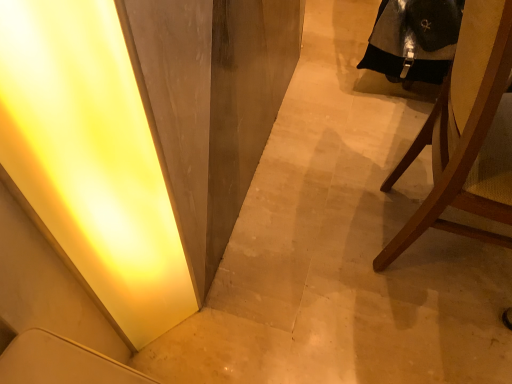
Question: Considering the positions of brown wooden chair at right and matte yellow light at lower left in the image, is brown wooden chair at right taller or shorter than matte yellow light at lower left?

Choices:
 (A) tall
 (B) short

Answer: (B)

Question: Would you say brown wooden chair at right is to the left or to the right of matte yellow light at lower left in the picture?

Choices:
 (A) left
 (B) right

Answer: (B)

Question: Which object is positioned closest to the matte yellow light at lower left?

Choices:
 (A) black leather robe at upper right
 (B) brown wooden chair at right

Answer: (B)

Question: Which object is the farthest from the brown wooden chair at right?

Choices:
 (A) matte yellow light at lower left
 (B) black leather robe at upper right

Answer: (A)